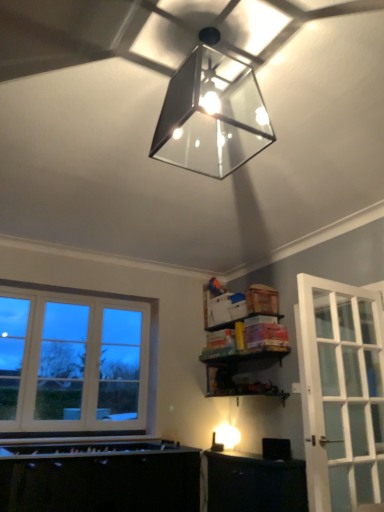
Question: From the image's perspective, is black plastic speaker at lower right above or below matte glass lampshade at upper center?

Choices:
 (A) below
 (B) above

Answer: (A)

Question: Do you think black plastic speaker at lower right is within matte glass lampshade at upper center, or outside of it?

Choices:
 (A) outside
 (B) inside

Answer: (A)

Question: Is black plastic speaker at lower right in front of or behind matte glass lampshade at upper center in the image?

Choices:
 (A) front
 (B) behind

Answer: (B)

Question: Considering the positions of matte glass lampshade at upper center and black plastic speaker at lower right in the image, is matte glass lampshade at upper center taller or shorter than black plastic speaker at lower right?

Choices:
 (A) short
 (B) tall

Answer: (B)

Question: From a real-world perspective, is matte glass lampshade at upper center positioned above or below black plastic speaker at lower right?

Choices:
 (A) above
 (B) below

Answer: (A)

Question: Is matte glass lampshade at upper center inside or outside of black plastic speaker at lower right?

Choices:
 (A) inside
 (B) outside

Answer: (B)

Question: Considering their positions, is matte glass lampshade at upper center located in front of or behind black plastic speaker at lower right?

Choices:
 (A) behind
 (B) front

Answer: (B)